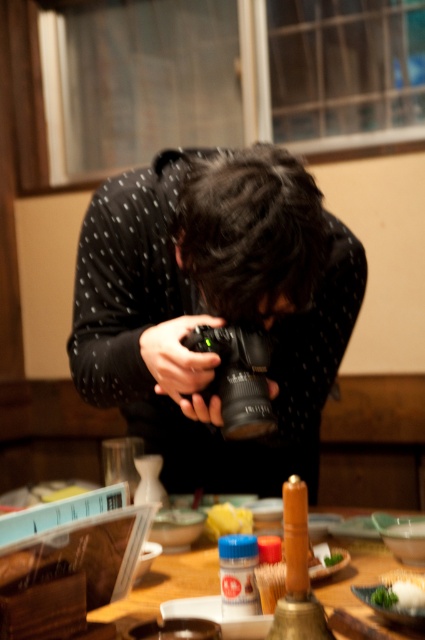
Can you confirm if black dotted sweater at center is wider than wooden table at center?

Correct, the width of black dotted sweater at center exceeds that of wooden table at center.

Where is `black dotted sweater at center`? This screenshot has width=425, height=640. black dotted sweater at center is located at coordinates (214, 307).

Can you confirm if black dotted sweater at center is bigger than white matte rice at lower right?

Correct, black dotted sweater at center is larger in size than white matte rice at lower right.

The width and height of the screenshot is (425, 640). What do you see at coordinates (214, 307) in the screenshot?
I see `black dotted sweater at center` at bounding box center [214, 307].

What do you see at coordinates (214, 307) in the screenshot?
I see `black dotted sweater at center` at bounding box center [214, 307].

In order to click on black dotted sweater at center in this screenshot , I will do `click(214, 307)`.

Does point (164, 596) come farther from viewer compared to point (374, 600)?

Yes, it is behind point (374, 600).

Is wooden table at center shorter than white matte rice at lower right?

No.

Describe the element at coordinates (166, 586) in the screenshot. I see `wooden table at center` at that location.

Locate an element on the screen. The height and width of the screenshot is (640, 425). wooden table at center is located at coordinates pyautogui.click(x=166, y=586).